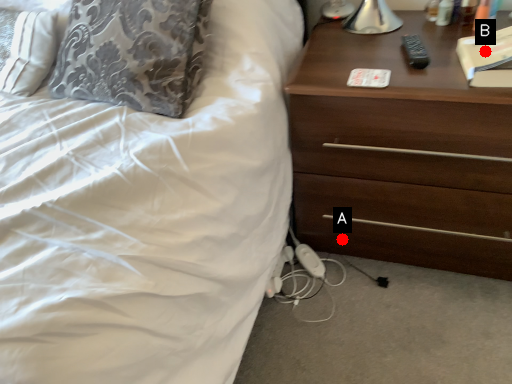
Question: Two points are circled on the image, labeled by A and B beside each circle. Which point is farther to the camera?

Choices:
 (A) A is further
 (B) B is further

Answer: (A)